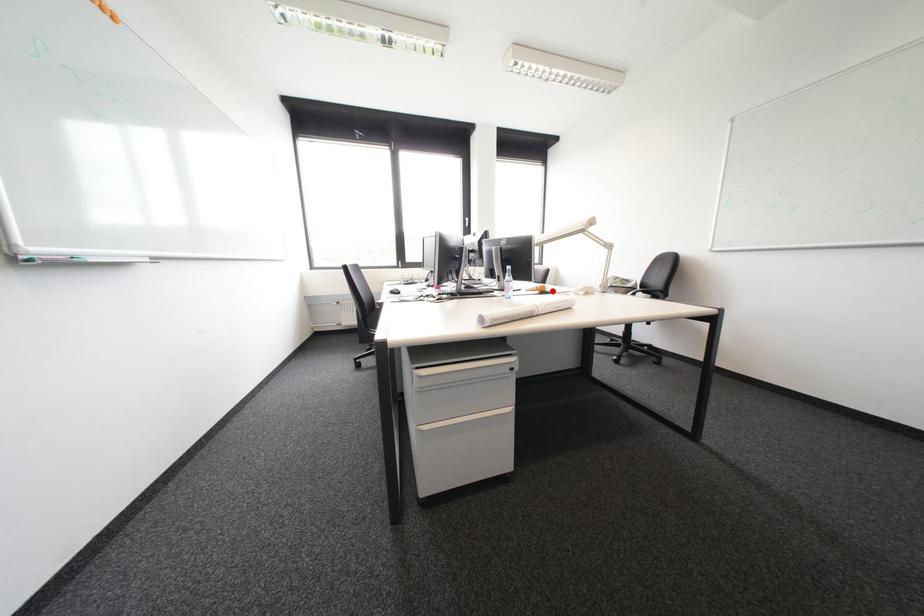
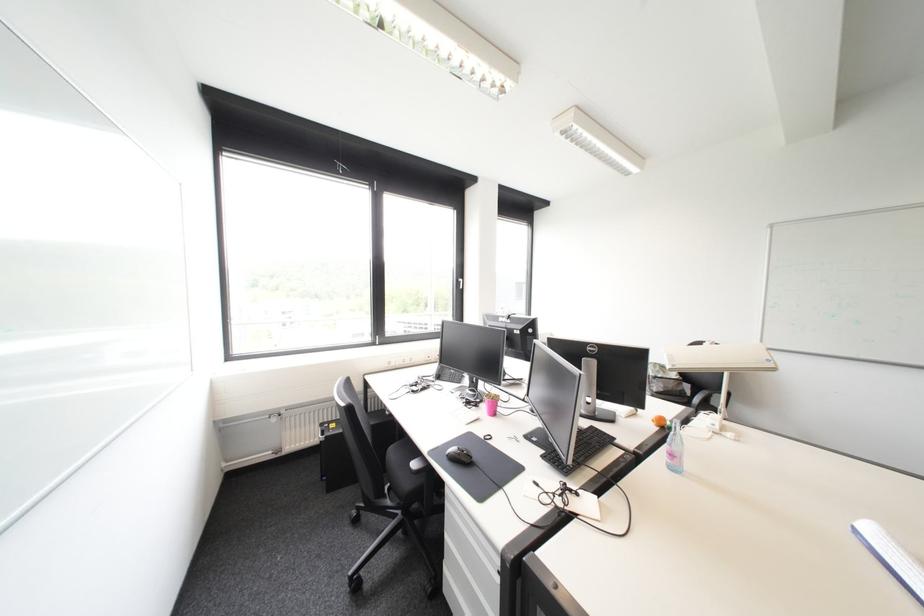
The point at the highlighted location is marked in the first image. Where is the corresponding point in the second image?

(673, 424)